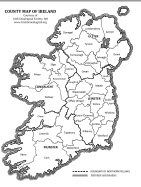
I want to click on small purple box, so click(x=79, y=174).